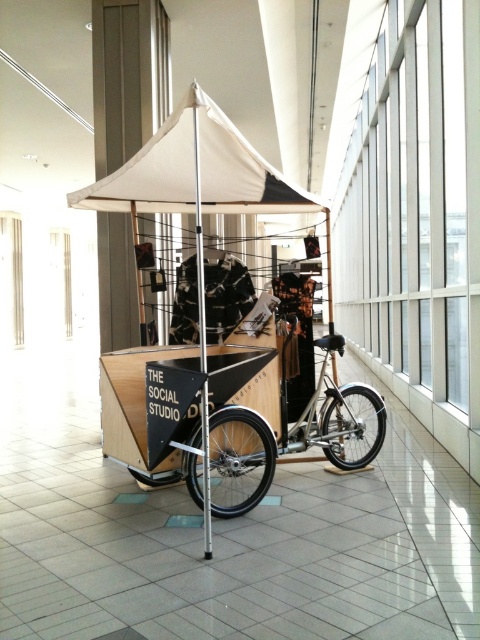
You are a delivery person who needs to move the silver metallic bicycle at center to the other side of the room. The white canvas canopy at center is in the way. Can you move the bicycle around the canopy without tilting it sideways?

The white canvas canopy at center might be wider than silver metallic bicycle at center, so there is a possibility that the bicycle can be moved around the canopy without tilting it sideways, but it depends on the exact width difference.

From the picture: You are standing at the entrance of the space and want to move towards the silver metallic bicycle at center. Which direction should you walk relative to the white canvas canopy at center?

The white canvas canopy at center is to the left of the silver metallic bicycle at center, so you should walk to the right of the white canvas canopy at center to reach the silver metallic bicycle at center.

Consider the image. You are a delivery person who needs to unload a package from the silver metallic bicycle at center to the white canvas canopy at center. Considering the distance between them, can you carry the package directly without needing to walk around any obstacles?

The white canvas canopy at center is 5.68 feet from the silver metallic bicycle at center. Since the distance is only about 5.68 feet, you can easily carry the package directly between them without needing to go around any obstacles.